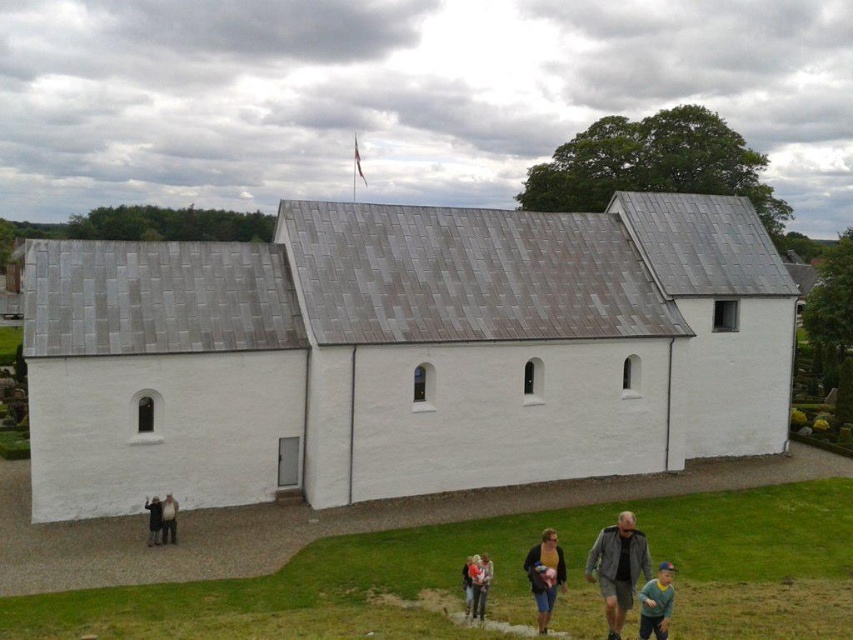
Question: Is light brown fabric jacket at lower center bigger than light brown leather jacket at lower center?

Choices:
 (A) no
 (B) yes

Answer: (A)

Question: Which object is positioned farthest from the dark blue fabric at lower center?

Choices:
 (A) gray fabric jacket at lower right
 (B) dark gray wool coat at lower left
 (C) white smooth chapel at center

Answer: (C)

Question: Is dark blue fabric at lower center to the right of light brown fabric jacket at lower center from the viewer's perspective?

Choices:
 (A) yes
 (B) no

Answer: (A)

Question: Estimate the real-world distances between objects in this image. Which object is farther from the gray fabric jacket at lower right?

Choices:
 (A) dark blue fabric at lower center
 (B) white smooth chapel at center
 (C) green cotton shirt at lower right
 (D) light brown fabric jacket at lower center

Answer: (B)

Question: Which point is farther to the camera?

Choices:
 (A) gray fabric jacket at lower right
 (B) white smooth chapel at center
 (C) dark blue fabric at lower center

Answer: (B)

Question: Does gray fabric jacket at lower right appear on the right side of green cotton shirt at lower right?

Choices:
 (A) yes
 (B) no

Answer: (B)